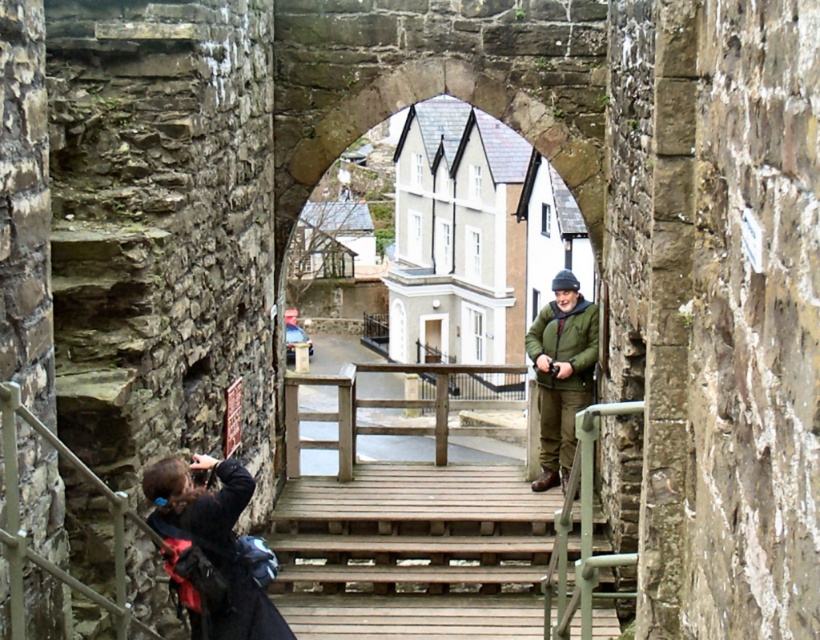
Is dark blue fabric at lower left bigger than green matte jacket at center?

No.

Who is shorter, dark blue fabric at lower left or green matte jacket at center?

With less height is dark blue fabric at lower left.

Where is `dark blue fabric at lower left`? dark blue fabric at lower left is located at coordinates (213, 541).